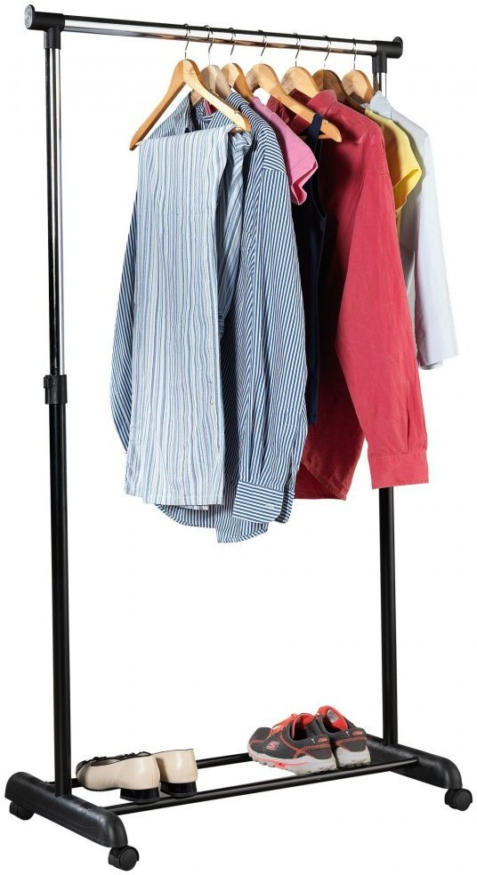
Where is `wood part of hangers`? This screenshot has height=875, width=477. wood part of hangers is located at coordinates (366, 81), (332, 81), (303, 80), (272, 79), (234, 77), (217, 77), (192, 74).